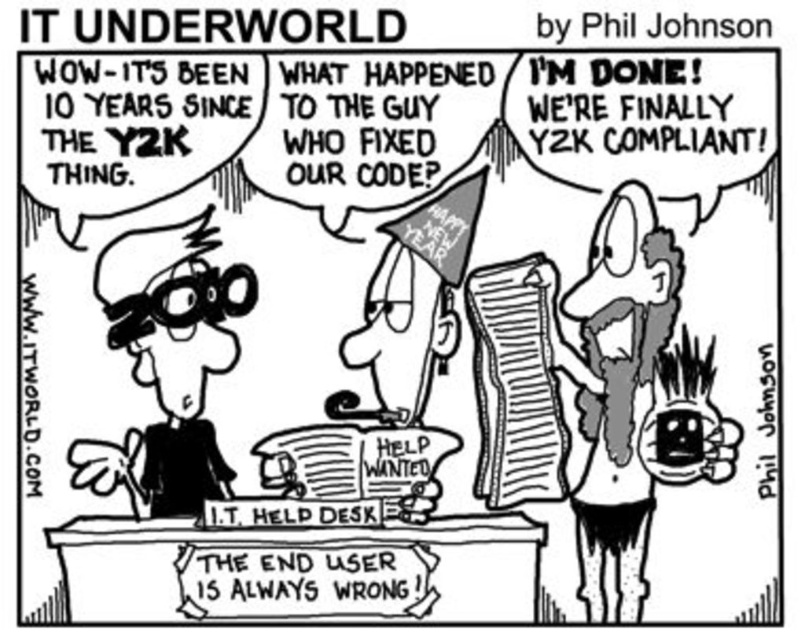
From the picture: You are observing the desk clerk in the I.T. HELP DESK scene. The clerk has two features visible in his appearance. Which feature is closer to you, the observer, between the shaggy hair at right and the matte black glasses at left?

The shaggy hair at right is closer to you because it is further to the viewer than the matte black glasses at left.

Looking at the Desk Clerk in the I.T. HELP DESK scene, can you determine if the shaggy hair at right is wider than the matte black glasses at left?

The shaggy hair at right is less wide than the matte black glasses at left, so no, it is not wider.

You are a delivery robot with a height of 1.6 meters. You need to deliver a package to the I.T. HELP DESK. When you arrive at the desk, your camera is positioned at point (653, 340). Can you see the desk clerk standing behind the desk?

The distance between the camera at point (653, 340) and the desk clerk is 1.77 meters. Since the desk clerk is standing behind the desk, and the robot is 1.6 meters tall, it is possible that the desk clerk is visible as long as the desk height does not obstruct the view. However, without knowing the desk height, we cannot confirm visibility.